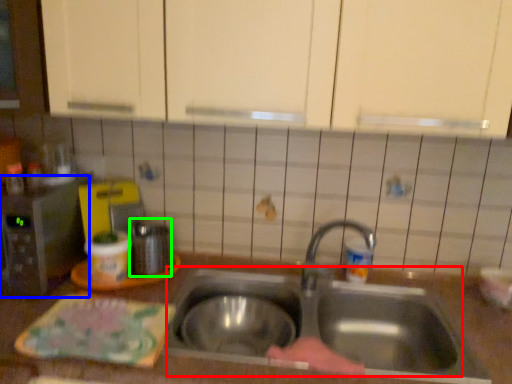
Question: Considering the real-world distances, which object is farthest from sink (highlighted by a red box)? appliance (highlighted by a blue box) or appliance (highlighted by a green box)?

Choices:
 (A) appliance
 (B) appliance

Answer: (A)